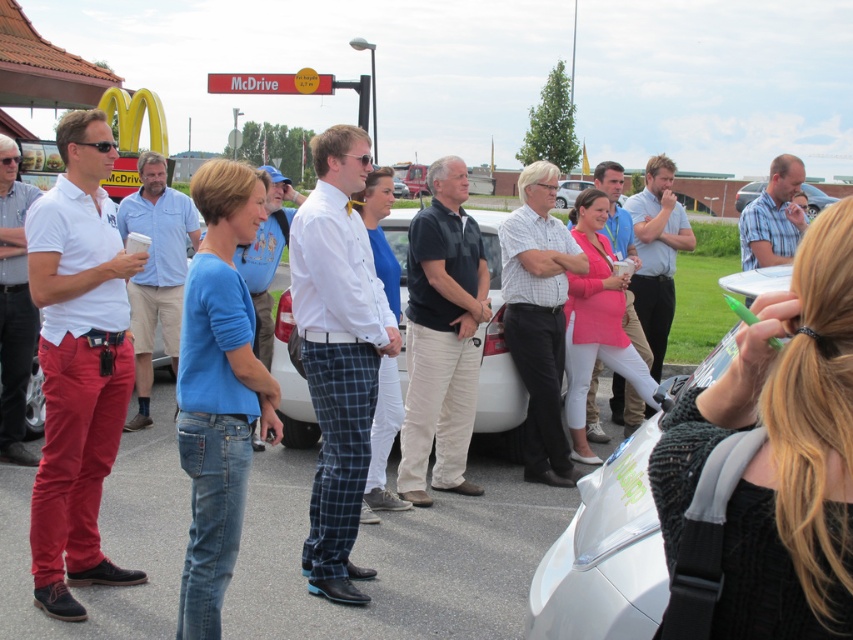
Question: Which object appears closest to the camera in this image?

Choices:
 (A) black knitwear at lower right
 (B) black cotton shirt at center
 (C) white glossy car at center

Answer: (A)

Question: Is black knitwear at lower right to the left of white matte car at center from the viewer's perspective?

Choices:
 (A) no
 (B) yes

Answer: (A)

Question: Which object appears farthest from the camera in this image?

Choices:
 (A) matte blue shirt at right
 (B) matte white shirt at left
 (C) white glossy car at center

Answer: (A)

Question: Can you confirm if matte white polo shirt at center is thinner than white matte car at center?

Choices:
 (A) no
 (B) yes

Answer: (A)

Question: Estimate the real-world distances between objects in this image. Which object is closer to the blue denim jeans at center?

Choices:
 (A) black knitwear at lower right
 (B) white matte car at center
 (C) black cotton shirt at center

Answer: (C)

Question: Is blue denim jeans at center bigger than black cotton shirt at center?

Choices:
 (A) yes
 (B) no

Answer: (A)